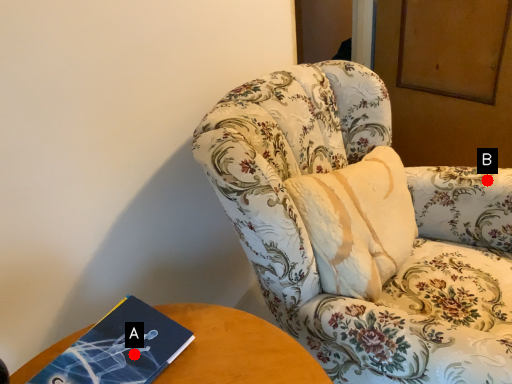
Question: Two points are circled on the image, labeled by A and B beside each circle. Among these points, which one is nearest to the camera?

Choices:
 (A) A is closer
 (B) B is closer

Answer: (A)